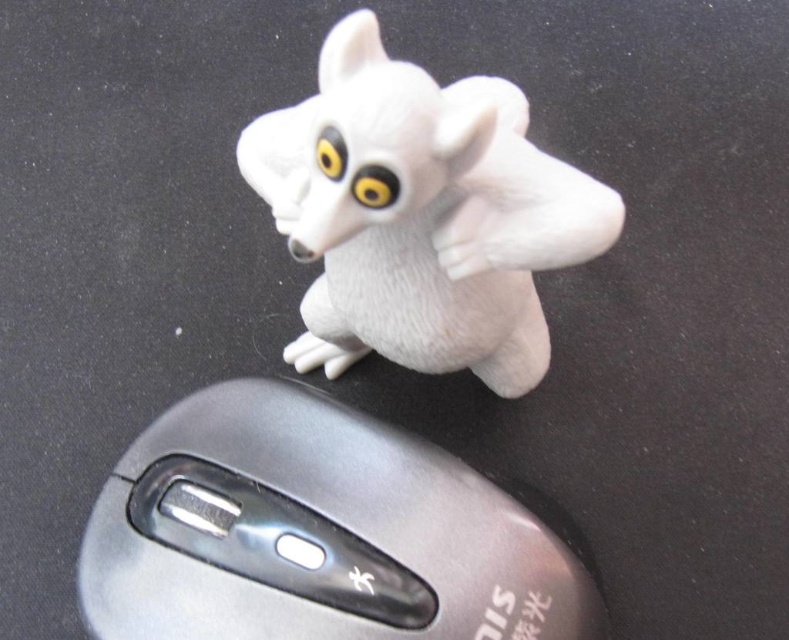
You are trying to reach a point behind the computer mouse with your hand. The point you want to reach is at point [260,552]. Is this point behind the computer mouse at point [514,236]?

Yes, the point [260,552] is behind the computer mouse at point [514,236] according to the spatial description provided.